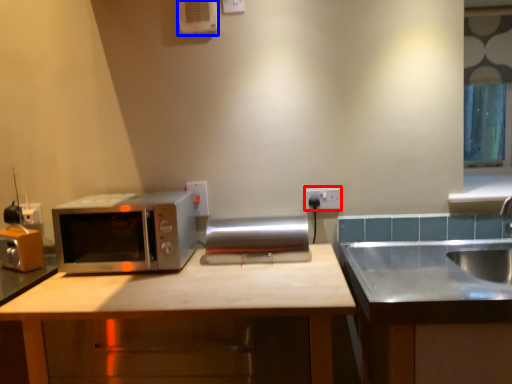
Question: Which object appears farthest to the camera in this image, electric outlet (highlighted by a red box) or air conditioner (highlighted by a blue box)?

Choices:
 (A) electric outlet
 (B) air conditioner

Answer: (A)